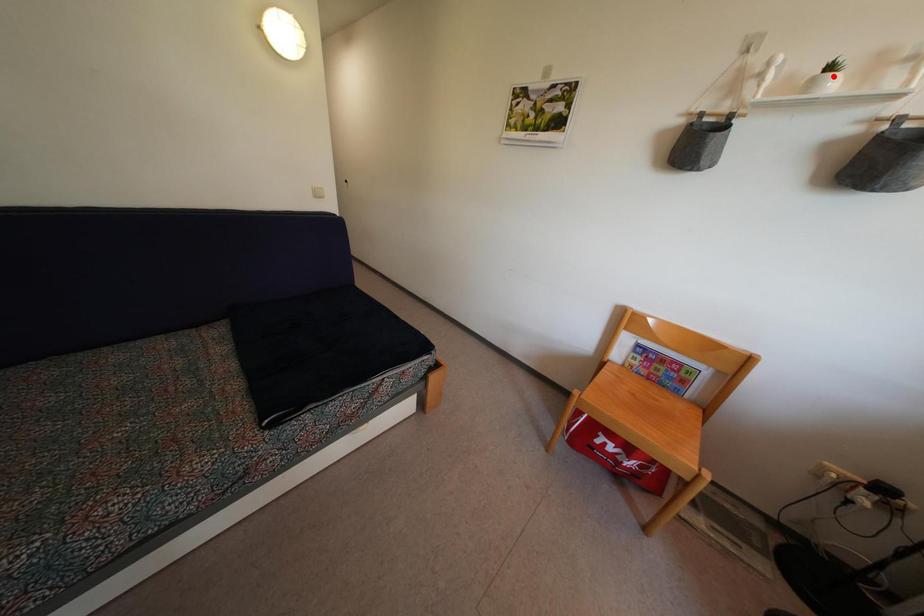
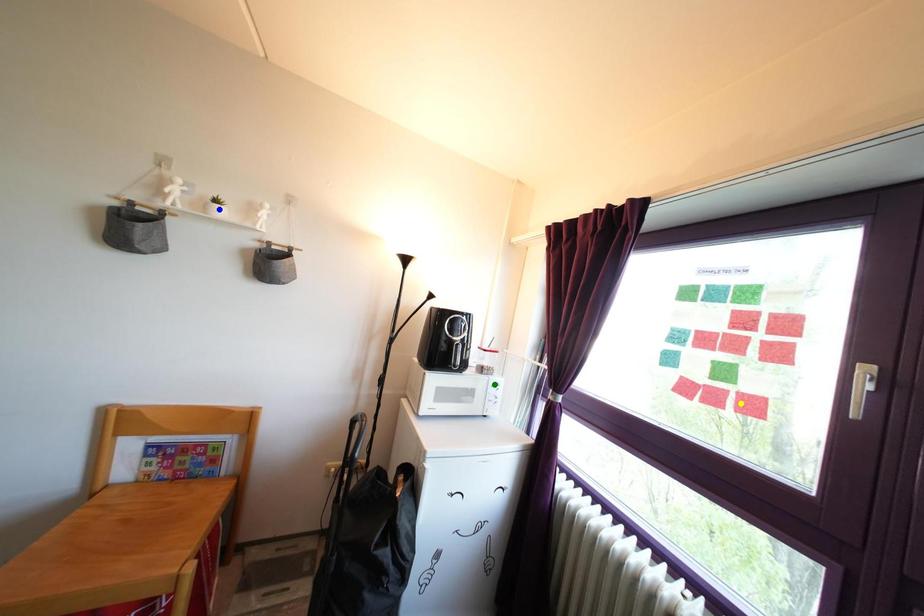
Question: I am providing you with two images of the same scene from different viewpoints. A red point is marked on the first image. You are given multiple points on the second image. In image 2, which mark is for the same physical point as the one in image 1?

Choices:
 (A) green point
 (B) blue point
 (C) yellow point

Answer: (B)